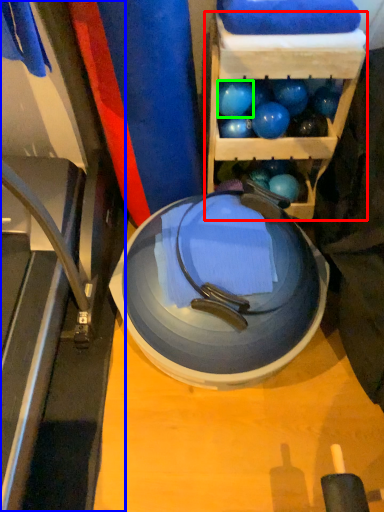
Question: Considering the real-world distances, which object is closest to shelf (highlighted by a red box)? treadmill (highlighted by a blue box) or ball (highlighted by a green box).

Choices:
 (A) treadmill
 (B) ball

Answer: (B)